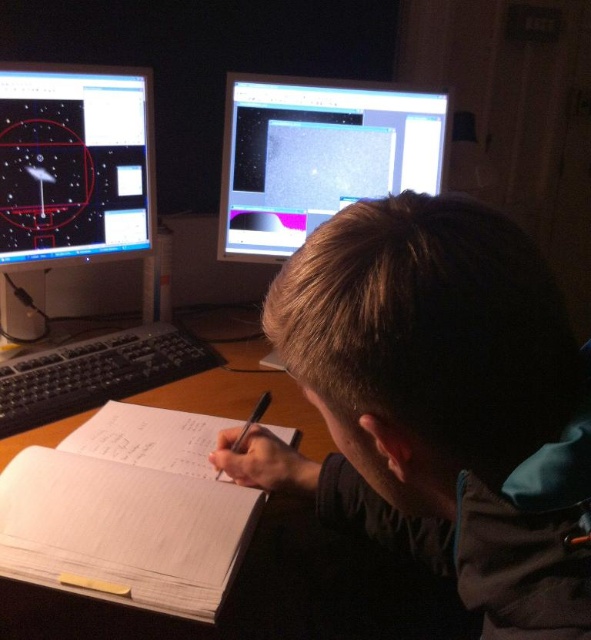
You are a delivery robot with a package that is 6 inches wide. You need to place it between the wooden at center and the white paper at center. Is there enough space?

The wooden at center is 5.73 inches from white paper at center, so the space between them is 5.73 inches. Since the package is 6 inches wide, it is slightly wider than the available space. Therefore, the package cannot be placed between them without overlapping.

You need to place a mouse that is 15 cm long between the matte black monitor at upper left and the black plastic keyboard at center. Is there enough space?

The matte black monitor at upper left is smaller than the black plastic keyboard at center. However, the description does not provide specific measurements of the space between them, so it is unclear if there is enough space for the mouse.

From the picture: You are setting up a dual monitor setup for a scientist who prefers to have their main monitor higher than the secondary one. Given the scene described, does the arrangement of the matte black monitor at upper center and the matte black monitor at upper left meet the scientist preferences?

Yes, the arrangement meets the scientist preferences because the matte black monitor at upper center is above the matte black monitor at upper left, placing the main monitor higher than the secondary one.